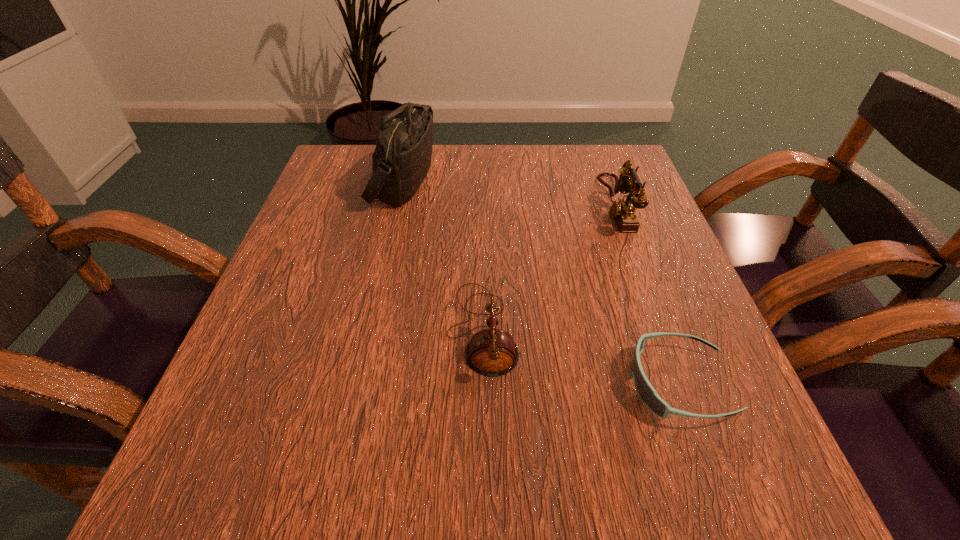
This screenshot has width=960, height=540. I want to click on telephone positioned at the right edge, so click(x=622, y=211).

Locate an element on the screen. This screenshot has width=960, height=540. goggles located at the right edge is located at coordinates (646, 392).

The image size is (960, 540). Find the location of `object that is at the far left corner`. object that is at the far left corner is located at coordinates (401, 160).

The width and height of the screenshot is (960, 540). Identify the location of object at the far right corner. (622, 211).

The height and width of the screenshot is (540, 960). Identify the location of vacant space at the far edge of the desktop. pos(478,150).

At what (x,y) coordinates should I click in order to perform the action: click on vacant space at the near edge of the desktop. Please return your answer as a coordinate pair (x, y). The width and height of the screenshot is (960, 540). Looking at the image, I should click on (601, 476).

In the image, there is a desktop. Where is `free space at the left edge`? The image size is (960, 540). free space at the left edge is located at coordinates (334, 286).

In the image, there is a desktop. At what (x,y) coordinates should I click in order to perform the action: click on free space at the right edge. Please return your answer as a coordinate pair (x, y). Looking at the image, I should click on (617, 354).

Where is `vacant space at the far right corner of the desktop`? vacant space at the far right corner of the desktop is located at coordinates (584, 177).

The image size is (960, 540). In order to click on vacant area that lies between the shoulder bag and the left telephone in this screenshot , I will do `click(443, 255)`.